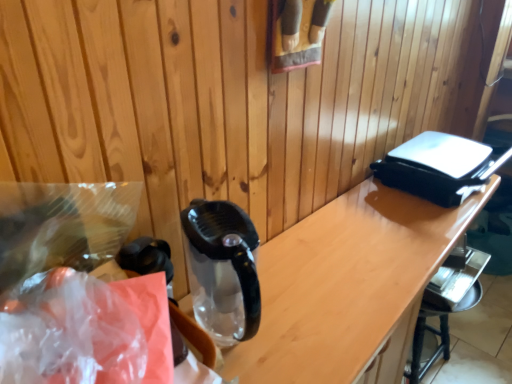
Question: Is metallic silver bar stool at lower right situated inside translucent plastic bag at left or outside?

Choices:
 (A) outside
 (B) inside

Answer: (A)

Question: Considering the positions of point pyautogui.click(x=440, y=309) and point pyautogui.click(x=141, y=331), is point pyautogui.click(x=440, y=309) closer or farther from the camera than point pyautogui.click(x=141, y=331)?

Choices:
 (A) closer
 (B) farther

Answer: (B)

Question: Which of these objects is positioned closest to the translucent plastic bag at left?

Choices:
 (A) transparent plastic bag at left
 (B) transparent glass table at center
 (C) metallic silver bar stool at lower right

Answer: (A)

Question: Based on their relative distances, which object is farther from the translucent plastic bag at left?

Choices:
 (A) transparent plastic bag at left
 (B) transparent glass table at center
 (C) metallic silver bar stool at lower right

Answer: (C)